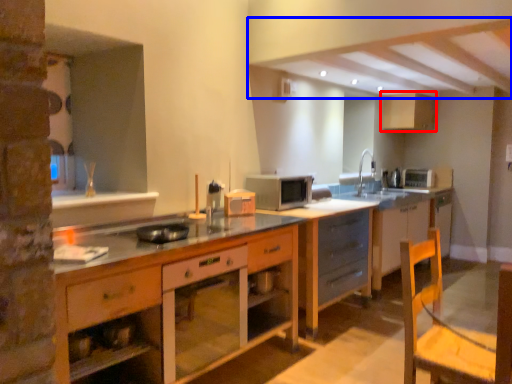
Question: Which of the following is the closest to the observer, cabinetry (highlighted by a red box) or exhaust hood (highlighted by a blue box)?

Choices:
 (A) cabinetry
 (B) exhaust hood

Answer: (B)